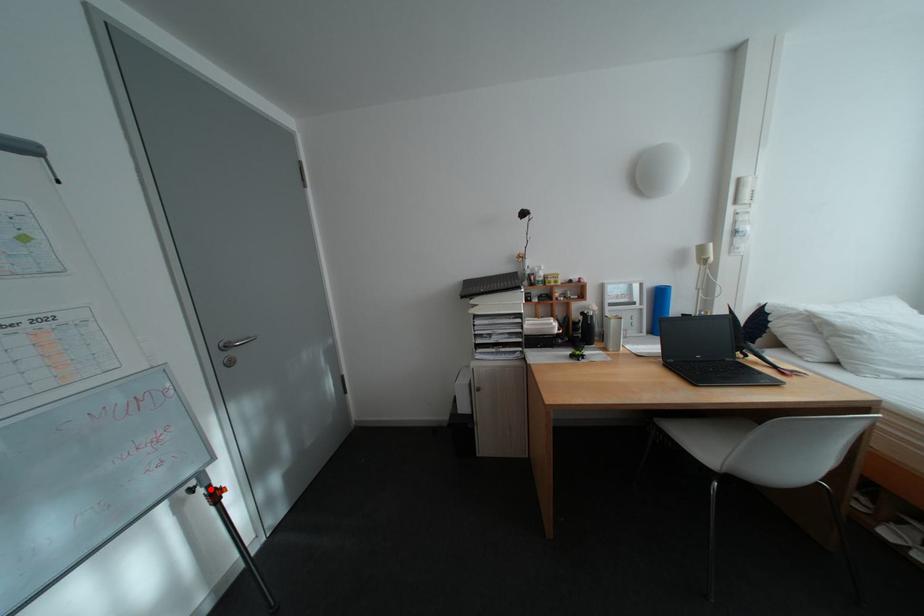
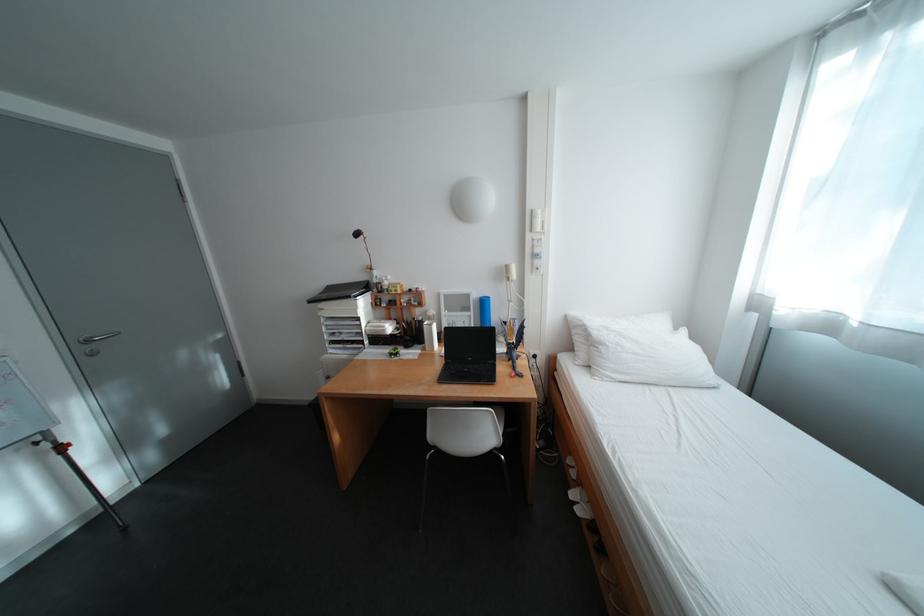
Find the pixel in the second image that matches the highlighted location in the first image.

(55, 444)